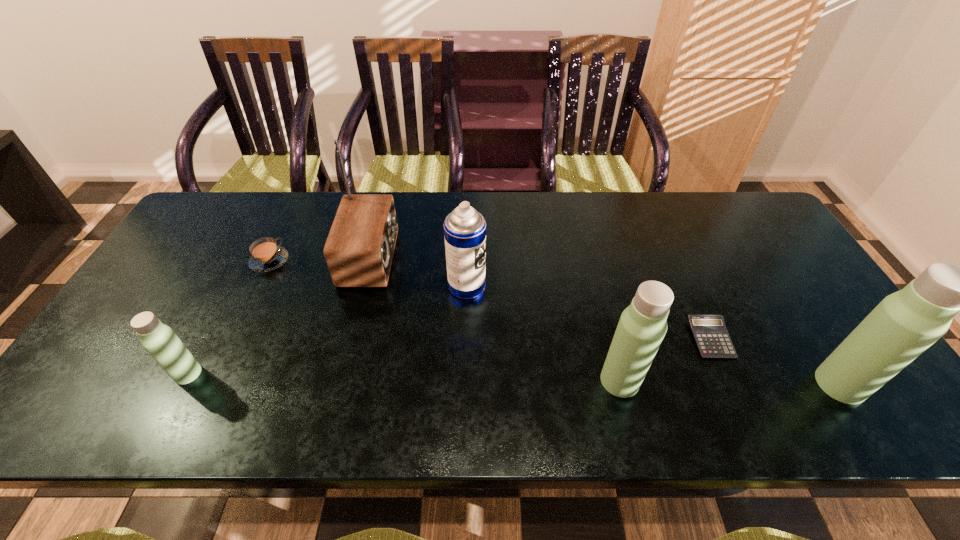
Where is `free region that satisfies the following two spatial constraints: 1. on the front-facing side of the radio receiver; 2. on the right side of the second thermos bottle from right to left`? free region that satisfies the following two spatial constraints: 1. on the front-facing side of the radio receiver; 2. on the right side of the second thermos bottle from right to left is located at coordinates click(x=341, y=381).

At what (x,y) coordinates should I click in order to perform the action: click on blank area in the image that satisfies the following two spatial constraints: 1. on the front-facing side of the fifth object from left to right; 2. on the right side of the third object from left to right. Please return your answer as a coordinate pair (x, y). Looking at the image, I should click on (341, 381).

Locate an element on the screen. free location that satisfies the following two spatial constraints: 1. on the label side of the second object from right to left; 2. on the right side of the fourth object from left to right is located at coordinates (466, 339).

What are the coordinates of `vacant space that satisfies the following two spatial constraints: 1. on the front-facing side of the radio receiver; 2. on the left side of the rightmost thermos bottle` in the screenshot? It's located at (340, 384).

Locate an element on the screen. vacant space that satisfies the following two spatial constraints: 1. on the back side of the shortest object; 2. on the left side of the leftmost thermos bottle is located at coordinates (206, 339).

Find the location of a particular element. blank space that satisfies the following two spatial constraints: 1. on the front-facing side of the fourth nearest object; 2. on the left side of the third object from left to right is located at coordinates click(351, 339).